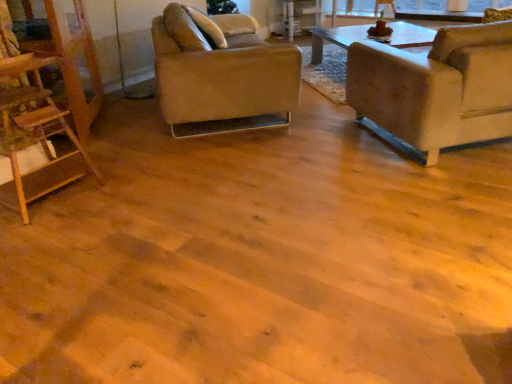
Question: From the image's perspective, does orange mesh radiator at upper left appear higher than suede-like beige chair at right, the first chair in the right-to-left sequence?

Choices:
 (A) yes
 (B) no

Answer: (A)

Question: Does orange mesh radiator at upper left have a lesser width compared to suede-like beige chair at right, the first chair in the right-to-left sequence?

Choices:
 (A) no
 (B) yes

Answer: (B)

Question: Are orange mesh radiator at upper left and suede-like beige chair at right, the first chair in the right-to-left sequence, far apart?

Choices:
 (A) no
 (B) yes

Answer: (B)

Question: Is orange mesh radiator at upper left looking in the opposite direction of suede-like beige chair at right, the 2th chair in the left-to-right sequence?

Choices:
 (A) yes
 (B) no

Answer: (B)

Question: Does orange mesh radiator at upper left have a larger size compared to suede-like beige chair at right, the first chair in the right-to-left sequence?

Choices:
 (A) no
 (B) yes

Answer: (A)

Question: Relative to suede-like beige chair at right, the 2th chair in the left-to-right sequence, is wooden ladder at left in front or behind?

Choices:
 (A) behind
 (B) front

Answer: (B)

Question: From the image's perspective, is wooden ladder at left above or below suede-like beige chair at right, the 2th chair in the left-to-right sequence?

Choices:
 (A) below
 (B) above

Answer: (A)

Question: Is wooden ladder at left taller or shorter than suede-like beige chair at right, the first chair in the right-to-left sequence?

Choices:
 (A) tall
 (B) short

Answer: (A)

Question: From a real-world perspective, is wooden ladder at left physically located above or below suede-like beige chair at right, the first chair in the right-to-left sequence?

Choices:
 (A) below
 (B) above

Answer: (B)

Question: From the image's perspective, is suede-like beige chair at right, the 2th chair in the left-to-right sequence, positioned above or below wooden ladder at left?

Choices:
 (A) below
 (B) above

Answer: (B)

Question: In terms of width, does suede-like beige chair at right, the first chair in the right-to-left sequence, look wider or thinner when compared to wooden ladder at left?

Choices:
 (A) wide
 (B) thin

Answer: (A)

Question: In terms of size, does suede-like beige chair at right, the 2th chair in the left-to-right sequence, appear bigger or smaller than wooden ladder at left?

Choices:
 (A) big
 (B) small

Answer: (A)

Question: Considering the relative positions of suede-like beige chair at right, the first chair in the right-to-left sequence, and wooden ladder at left in the image provided, is suede-like beige chair at right, the first chair in the right-to-left sequence, to the left or to the right of wooden ladder at left?

Choices:
 (A) right
 (B) left

Answer: (A)

Question: Would you say orange mesh radiator at upper left is inside or outside suede-like beige chair at right, the first chair in the right-to-left sequence?

Choices:
 (A) outside
 (B) inside

Answer: (A)

Question: In the image, is orange mesh radiator at upper left on the left side or the right side of suede-like beige chair at right, the first chair in the right-to-left sequence?

Choices:
 (A) left
 (B) right

Answer: (A)